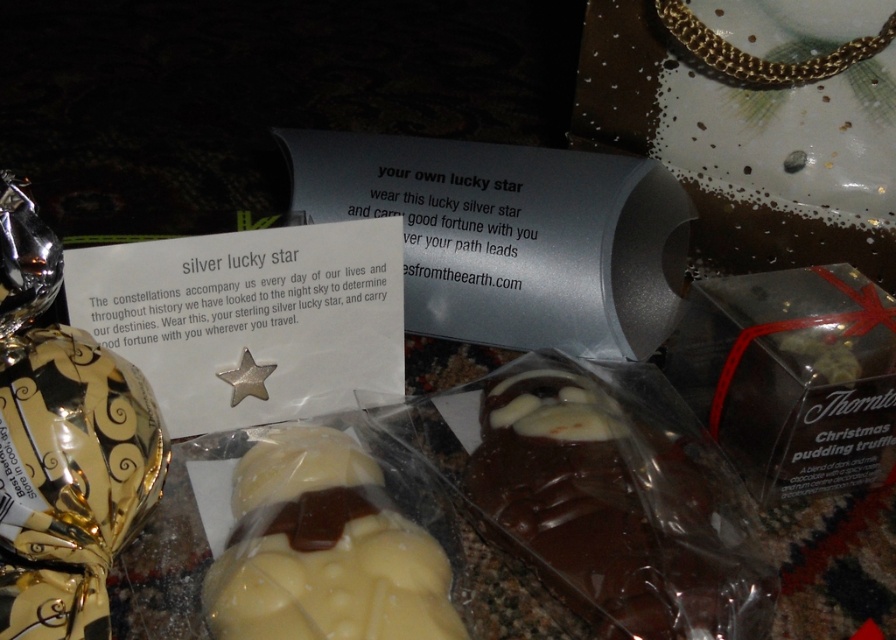
Based on the photo, you are a customer at a luxury store and see the dark chocolate truffle at center and the white chocolate at center. Which one do you think has a larger width?

The dark chocolate truffle at center might be wider than white chocolate at center according to the description.

In the scene shown: You are a photographer setting up a shot of the luxury items displayed on the countertop. You need to focus on two specific points marked as point 1 at coordinates point (79, 433) and point 2 at coordinates point (286, 545). Which point should you focus on first if you want to ensure the closest object is in sharp focus?

Point (79, 433) is closer to the camera than point (286, 545), so you should focus on point (79, 433) first to ensure the closest object is in sharp focus.

You are a customer at a luxury store and see two points marked in the scene. The first point is at coordinate point (660, 506) and the second is at point (136, 385). Which point is closer to you as you look at the display?

Point (660, 506) is further to the viewer than point (136, 385), so the first point is closer to you.